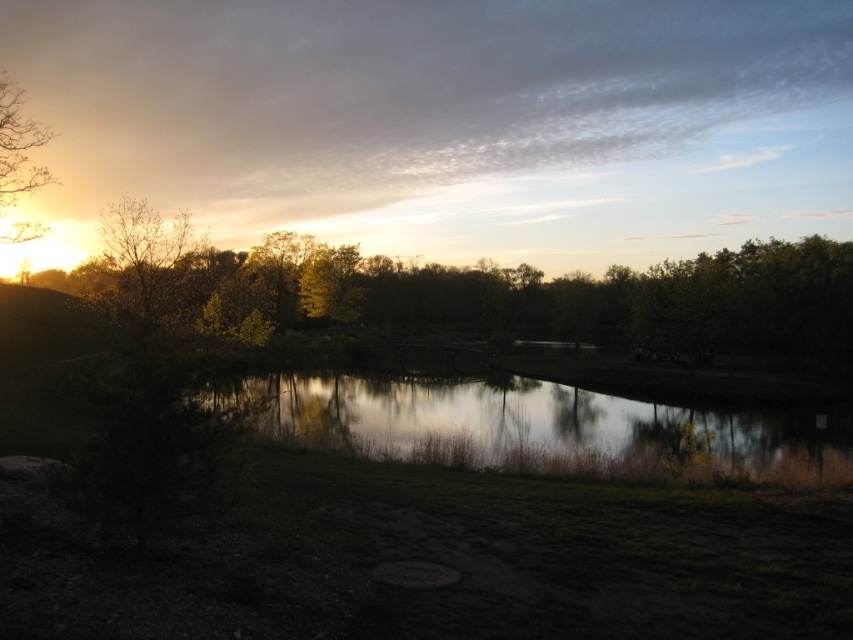
Question: Based on their relative distances, which object is farther from the bare branches at left?

Choices:
 (A) reflective glass water at center
 (B) brown leafy tree at upper left
 (C) green leafy tree at left

Answer: (C)

Question: Does green leafy tree at left appear under bare branches at left?

Choices:
 (A) yes
 (B) no

Answer: (A)

Question: Based on their relative distances, which object is nearer to the reflective glass water at center?

Choices:
 (A) green leafy tree at left
 (B) brown leafy tree at upper left
 (C) bare branches at left

Answer: (A)

Question: Can you confirm if bare branches at left is thinner than brown leafy tree at upper left?

Choices:
 (A) no
 (B) yes

Answer: (B)

Question: Estimate the real-world distances between objects in this image. Which object is farther from the bare branches at left?

Choices:
 (A) green leafy tree at left
 (B) brown leafy tree at upper left
 (C) reflective glass water at center

Answer: (A)

Question: Can you confirm if green leafy tree at left is wider than bare branches at left?

Choices:
 (A) no
 (B) yes

Answer: (B)